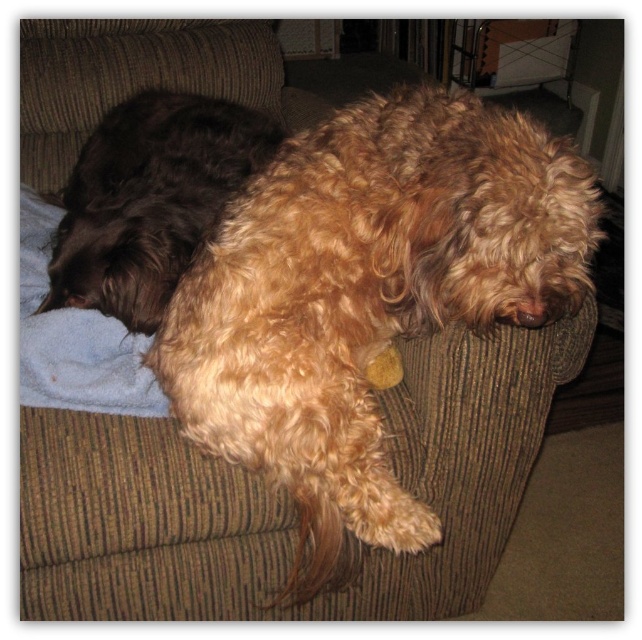
You are trying to determine which dog is wider between the fuzzy brown dog at center and the shaggy brown dog at upper left. Based on the scene, which one has a greater width?

The fuzzy brown dog at center has a greater width than the shaggy brown dog at upper left.

You are a photographer setting up a shoot in the living room. You need to position a light source to the left of both the fuzzy brown dog at center and the shaggy brown dog at upper left. Which dog should you place the light source to the left of to ensure it illuminates both dogs adequately?

You should place the light source to the left of the shaggy brown dog at upper left. Since the fuzzy brown dog at center is to the right of the shaggy brown dog at upper left, positioning the light to the left of the shaggy brown dog would also be to the left of the fuzzy brown dog, ensuring both are illuminated adequately.

You are a photographer setting up a shoot in the living room. You need to position a light source so that it illuminates both the fuzzy brown dog at center and the shaggy brown dog at upper left without casting harsh shadows. Considering their positions, where should you place the light source relative to the dogs?

Since the fuzzy brown dog at center is located below the shaggy brown dog at upper left, placing the light source above and between both dogs would ensure even illumination and minimize harsh shadows caused by their overlapping positions.